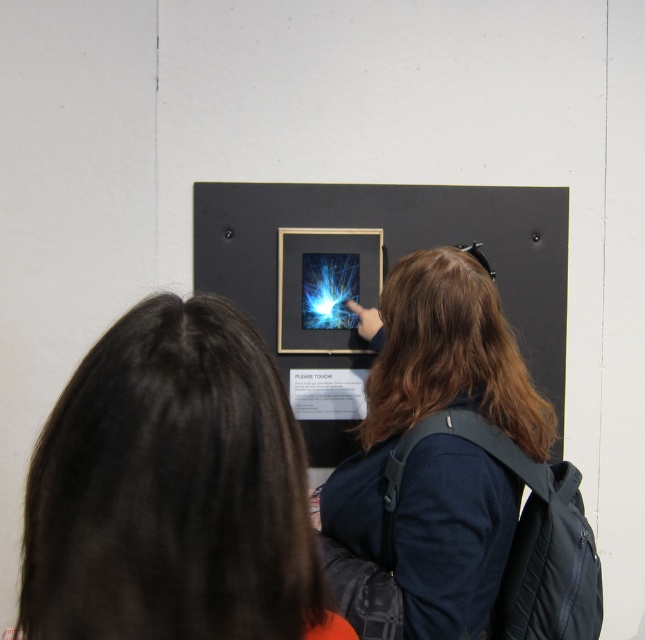
Is dark brown hair at center shorter than matte black backpack at center?

Yes, dark brown hair at center is shorter than matte black backpack at center.

Can you confirm if dark brown hair at center is positioned below matte black backpack at center?

No, dark brown hair at center is not below matte black backpack at center.

Who is more forward, (219, 544) or (444, 273)?

Point (219, 544) is in front.

Locate an element on the screen. The height and width of the screenshot is (640, 645). dark brown hair at center is located at coordinates (172, 490).